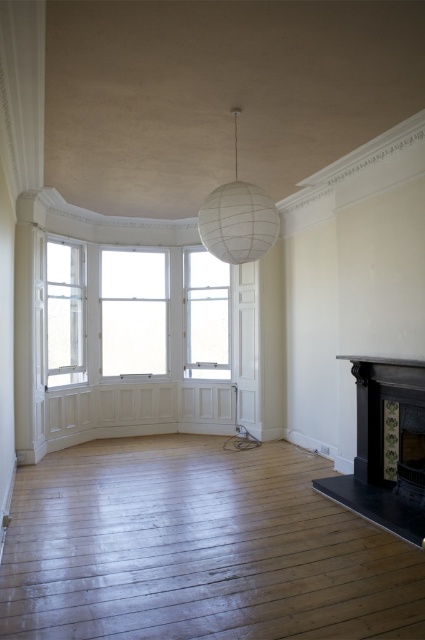
Can you confirm if black stone fireplace at lower right is positioned to the right of clear glass window at left?

Yes, black stone fireplace at lower right is to the right of clear glass window at left.

Is black stone fireplace at lower right to the left of clear glass window at left from the viewer's perspective?

In fact, black stone fireplace at lower right is to the right of clear glass window at left.

Does point (328, 483) lie in front of point (82, 268)?

Yes, point (328, 483) is closer to viewer.

Identify the location of black stone fireplace at lower right. (385, 448).

How much distance is there between white glass window at center and clear glass window at left?

white glass window at center and clear glass window at left are 27.32 inches apart from each other.

Between point (112, 253) and point (65, 376), which one is positioned in front?

Point (65, 376) is more forward.

The height and width of the screenshot is (640, 425). Find the location of `white glass window at center`. white glass window at center is located at coordinates (133, 312).

Which of these two, clear glass window at center or clear glass window at left, stands taller?

clear glass window at center

Between point (192, 376) and point (65, 252), which one is positioned in front?

Positioned in front is point (65, 252).

You are a GUI agent. You are given a task and a screenshot of the screen. Output one action in this format:
    pyautogui.click(x=<x>, y=<y>)
    Task: Click on the clear glass window at center
    The image size is (425, 640).
    Given the screenshot: What is the action you would take?
    pyautogui.click(x=206, y=316)

I want to click on clear glass window at center, so click(206, 316).